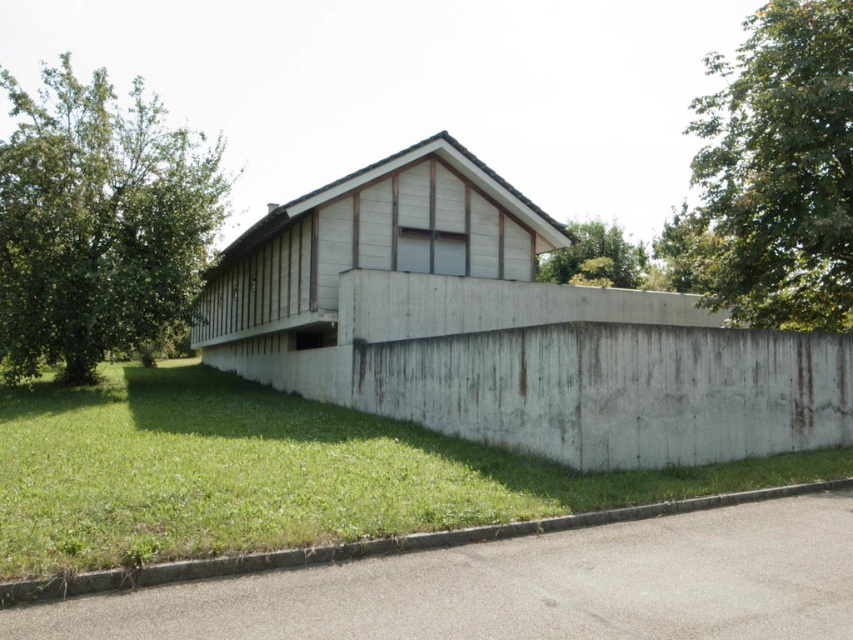
Between point (838, 109) and point (619, 268), which one is positioned behind?

The point (619, 268) is behind.

Where is `green leafy tree at upper right`? green leafy tree at upper right is located at coordinates (775, 173).

Between point (801, 538) and point (619, 262), which one is positioned in front?

Point (801, 538)

Is gray concrete curb at lower right positioned at the back of green leafy tree at upper center?

No.

Who is more forward, (776, 636) or (563, 282)?

Point (776, 636)

At what (x,y) coordinates should I click in order to perform the action: click on gray concrete curb at lower right. Please return your answer as a coordinate pair (x, y). The width and height of the screenshot is (853, 640). Looking at the image, I should click on (521, 588).

Between green leafy tree at left and green leafy tree at upper center, which one is positioned higher?

green leafy tree at left is higher up.

Can you confirm if green leafy tree at left is shorter than green leafy tree at upper center?

Incorrect, green leafy tree at left's height does not fall short of green leafy tree at upper center's.

What do you see at coordinates (97, 224) in the screenshot?
I see `green leafy tree at left` at bounding box center [97, 224].

The image size is (853, 640). I want to click on green leafy tree at left, so click(97, 224).